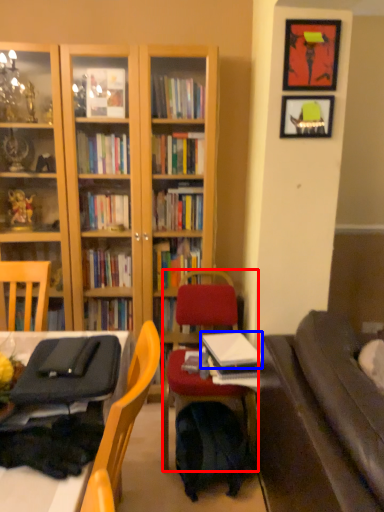
Question: Which of the following is the closest to the observer, chair (highlighted by a red box) or book (highlighted by a blue box)?

Choices:
 (A) chair
 (B) book

Answer: (A)